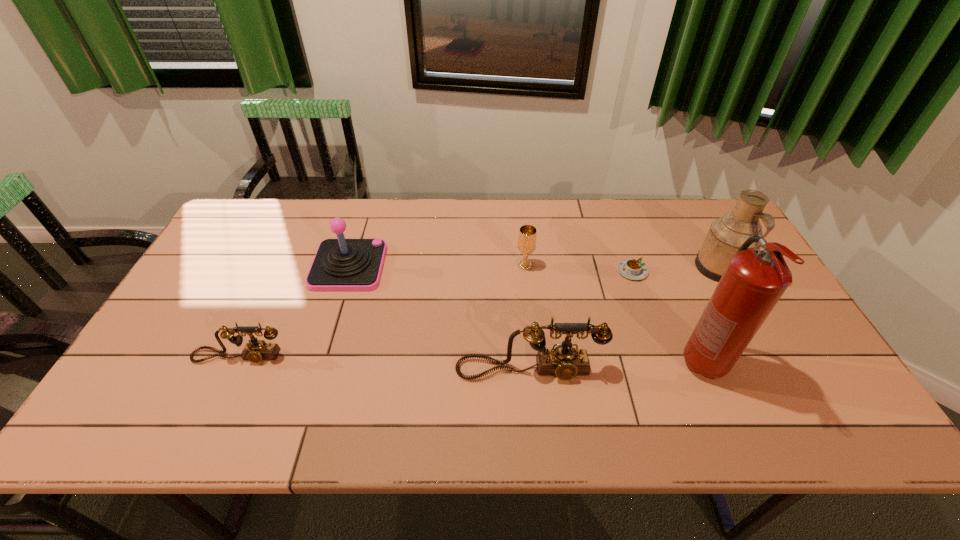
Where is `vacant position located 0.300m on the left of the chalice`? The height and width of the screenshot is (540, 960). vacant position located 0.300m on the left of the chalice is located at coordinates (417, 265).

Find the location of a particular element. This screenshot has width=960, height=540. vacant space located forward from the base of the joystick is located at coordinates (440, 266).

The width and height of the screenshot is (960, 540). I want to click on vacant region located 0.100m on the left of the pudding, so click(584, 271).

Where is `vacant space located 0.060m on the back of the rightmost object`? The width and height of the screenshot is (960, 540). vacant space located 0.060m on the back of the rightmost object is located at coordinates (704, 239).

The height and width of the screenshot is (540, 960). Identify the location of fire extinguisher present at the near edge. (753, 282).

Locate an element on the screen. The width and height of the screenshot is (960, 540). object present at the left edge is located at coordinates (256, 350).

The height and width of the screenshot is (540, 960). In order to click on object that is at the right edge in this screenshot , I will do [x=726, y=235].

Find the location of a particular element. object present at the near left corner is located at coordinates (256, 350).

The image size is (960, 540). In order to click on free region at the far edge of the desktop in this screenshot , I will do `click(351, 200)`.

Where is `free space at the near edge of the desktop`? The image size is (960, 540). free space at the near edge of the desktop is located at coordinates (319, 389).